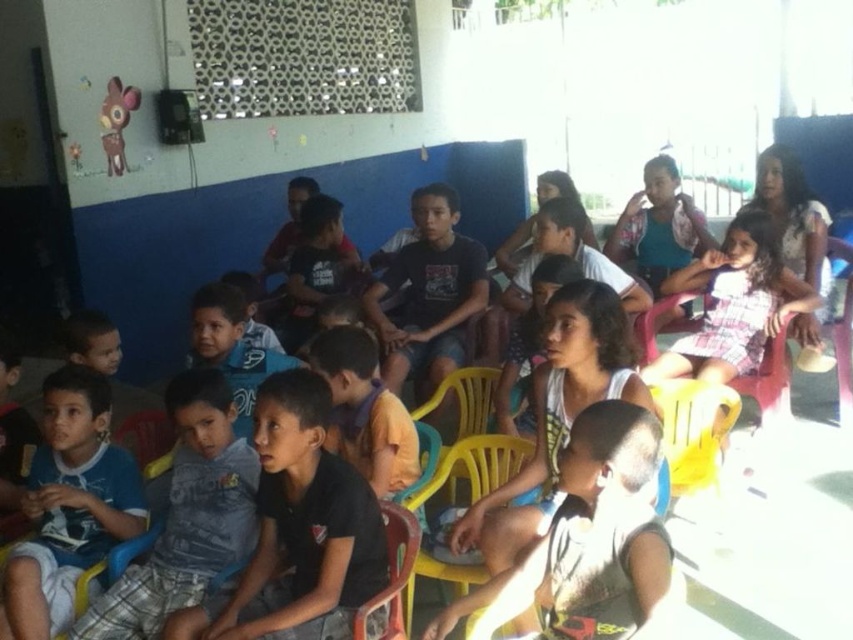
You are a child sitting on the yellow plastic chair at center and want to pass a note to the child wearing the blue cotton shirt at lower left. Can you reach them without leaving your seat if your arms can extend 30 inches?

The blue cotton shirt at lower left is 33.34 inches away from the yellow plastic chair at center. Since your arms can only extend 30 inches, you cannot reach them without leaving your seat.

What is located at the coordinate point (68, 504) in the image?

The blue cotton shirt at lower left is located at point (68, 504).